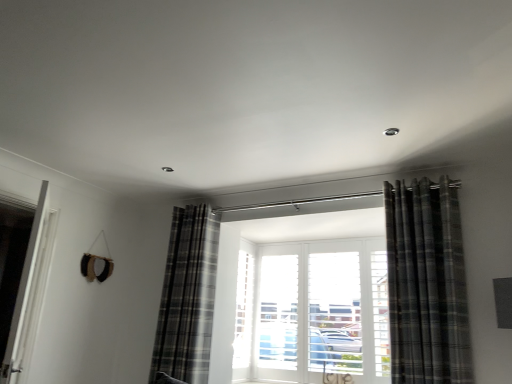
Question: Does white glossy door at left have a larger size compared to plaid fabric curtain at right, the 2th curtain positioned from the left?

Choices:
 (A) no
 (B) yes

Answer: (A)

Question: From the image's perspective, is white glossy door at left under plaid fabric curtain at right, placed as the first curtain when sorted from right to left?

Choices:
 (A) no
 (B) yes

Answer: (B)

Question: Is white glossy door at left looking in the opposite direction of plaid fabric curtain at right, placed as the first curtain when sorted from right to left?

Choices:
 (A) yes
 (B) no

Answer: (A)

Question: Is white glossy door at left next to plaid fabric curtain at right, the 2th curtain positioned from the left?

Choices:
 (A) no
 (B) yes

Answer: (A)

Question: Can you confirm if white glossy door at left is smaller than plaid fabric curtain at right, the 2th curtain in the back-to-front sequence?

Choices:
 (A) no
 (B) yes

Answer: (B)

Question: From a real-world perspective, is white glossy door at left physically located above or below plaid fabric curtain at right, the 2th curtain positioned from the left?

Choices:
 (A) below
 (B) above

Answer: (A)

Question: Considering the positions of point (41, 223) and point (402, 215), is point (41, 223) closer or farther from the camera than point (402, 215)?

Choices:
 (A) closer
 (B) farther

Answer: (B)

Question: Relative to plaid fabric curtain at right, placed as the first curtain when sorted from right to left, is white glossy door at left in front or behind?

Choices:
 (A) behind
 (B) front

Answer: (B)

Question: In terms of size, does white glossy door at left appear bigger or smaller than plaid fabric curtain at right, marked as the 1th curtain in a front-to-back arrangement?

Choices:
 (A) big
 (B) small

Answer: (B)

Question: From their relative heights in the image, would you say plaid fabric curtain at right, the 2th curtain positioned from the left, is taller or shorter than white glossy door at left?

Choices:
 (A) tall
 (B) short

Answer: (A)

Question: Is plaid fabric curtain at right, placed as the first curtain when sorted from right to left, wider or thinner than white glossy door at left?

Choices:
 (A) thin
 (B) wide

Answer: (B)

Question: From the image's perspective, relative to white glossy door at left, is plaid fabric curtain at right, marked as the 1th curtain in a front-to-back arrangement, above or below?

Choices:
 (A) above
 (B) below

Answer: (A)

Question: Considering the relative positions of plaid fabric curtain at right, marked as the 1th curtain in a front-to-back arrangement, and white glossy door at left in the image provided, is plaid fabric curtain at right, marked as the 1th curtain in a front-to-back arrangement, to the left or to the right of white glossy door at left?

Choices:
 (A) right
 (B) left

Answer: (A)

Question: Considering the positions of plaid fabric curtain at center, which is the 1th curtain in back-to-front order, and plaid fabric curtain at right, the 2th curtain in the back-to-front sequence, in the image, is plaid fabric curtain at center, which is the 1th curtain in back-to-front order, wider or thinner than plaid fabric curtain at right, the 2th curtain in the back-to-front sequence,?

Choices:
 (A) wide
 (B) thin

Answer: (A)

Question: From the image's perspective, is plaid fabric curtain at center, positioned as the first curtain in left-to-right order, above or below plaid fabric curtain at right, the 2th curtain in the back-to-front sequence?

Choices:
 (A) above
 (B) below

Answer: (B)